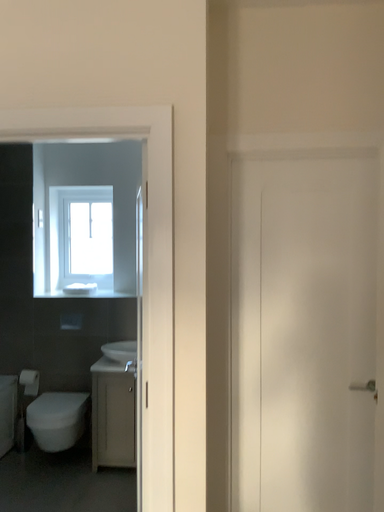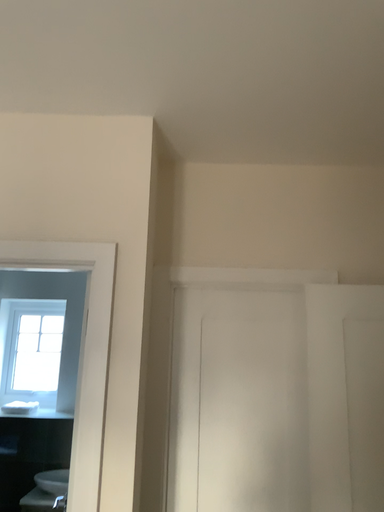
Question: Which way did the camera rotate in the video?

Choices:
 (A) rotated upward
 (B) rotated downward

Answer: (A)